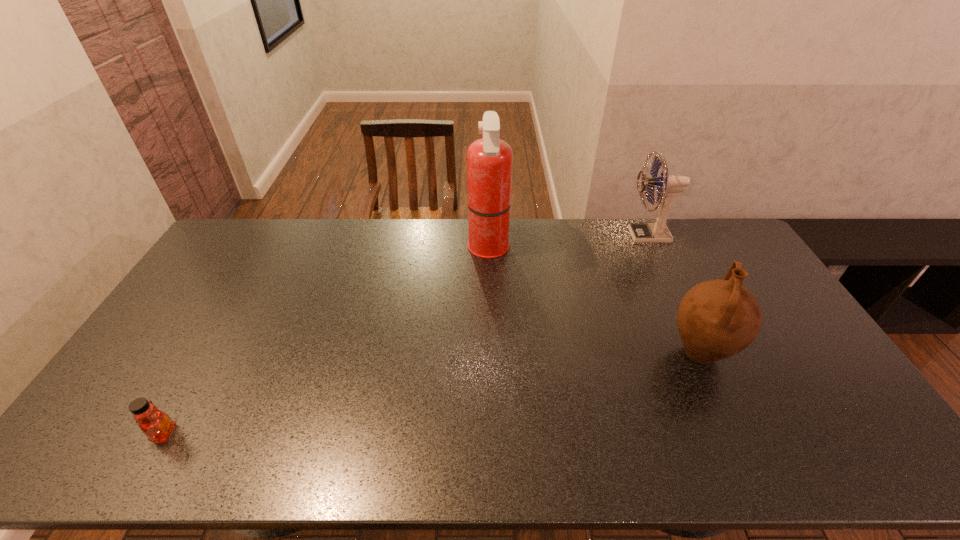
Identify the location of vacant space located on the front-facing side of the fan. The height and width of the screenshot is (540, 960). (588, 235).

This screenshot has height=540, width=960. What are the coordinates of `free point located on the front-facing side of the fan` in the screenshot? It's located at (548, 235).

At what (x,y) coordinates should I click in order to perform the action: click on vacant space located on the back of the second nearest object. Please return your answer as a coordinate pair (x, y). Image resolution: width=960 pixels, height=540 pixels. Looking at the image, I should click on (652, 252).

Identify the location of vacant space located on the front label of the leftmost object. The height and width of the screenshot is (540, 960). (319, 434).

The height and width of the screenshot is (540, 960). In order to click on fire extinguisher located at the far edge in this screenshot , I will do `click(489, 160)`.

Where is `fan at the far edge`? The image size is (960, 540). fan at the far edge is located at coordinates (670, 185).

I want to click on object positioned at the near edge, so click(156, 425).

Find the location of a particular element. This screenshot has height=540, width=960. free region at the far edge is located at coordinates (676, 239).

You are a GUI agent. You are given a task and a screenshot of the screen. Output one action in this format:
    pyautogui.click(x=<x>, y=<y>)
    Task: Click on the vacant position at the near edge of the desktop
    Image resolution: width=960 pixels, height=540 pixels.
    Given the screenshot: What is the action you would take?
    pyautogui.click(x=726, y=442)

The height and width of the screenshot is (540, 960). I want to click on vacant space at the right edge, so click(790, 338).